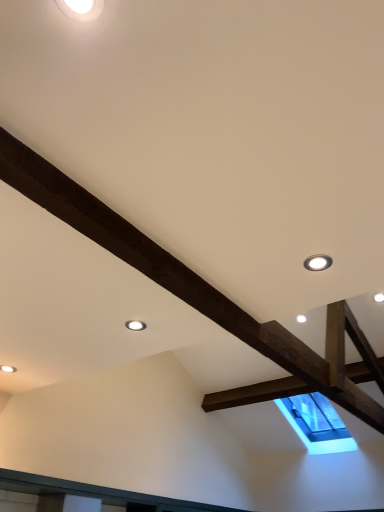
Question: Is matte white droplight at upper center, the 3th droplight when ordered from top to bottom, positioned far away from matte white droplight at upper right, positioned as the second droplight in bottom-to-top order?

Choices:
 (A) no
 (B) yes

Answer: (A)

Question: Is matte white droplight at upper center, which ranks as the first droplight in back-to-front order, outside matte white droplight at upper right, acting as the 2th droplight starting from the back?

Choices:
 (A) no
 (B) yes

Answer: (B)

Question: Does matte white droplight at upper center, which ranks as the first droplight in back-to-front order, have a smaller size compared to matte white droplight at upper right, acting as the second droplight starting from the front?

Choices:
 (A) yes
 (B) no

Answer: (A)

Question: Is matte white droplight at upper center, which ranks as the 3th droplight in right-to-left order, in contact with matte white droplight at upper right, which is counted as the first droplight, starting from the right?

Choices:
 (A) no
 (B) yes

Answer: (A)

Question: Is matte white droplight at upper center, which ranks as the 3th droplight in right-to-left order, turned away from matte white droplight at upper right, positioned as the second droplight in bottom-to-top order?

Choices:
 (A) yes
 (B) no

Answer: (B)

Question: From a real-world perspective, is matte white droplight at upper center, the 3th droplight when ordered from top to bottom, located beneath matte white droplight at upper right, arranged as the second droplight when viewed from the top?

Choices:
 (A) no
 (B) yes

Answer: (B)

Question: Does white glossy droplight at upper left, placed as the 1th droplight when sorted from top to bottom, have a greater width compared to matte white droplight at upper right, acting as the second droplight starting from the front?

Choices:
 (A) yes
 (B) no

Answer: (B)

Question: Is white glossy droplight at upper left, which appears as the second droplight when viewed from the right, bigger than matte white droplight at upper right, which is counted as the first droplight, starting from the right?

Choices:
 (A) yes
 (B) no

Answer: (B)

Question: Considering the relative positions of white glossy droplight at upper left, which ranks as the 1th droplight in front-to-back order, and matte white droplight at upper right, positioned as the second droplight in bottom-to-top order, in the image provided, is white glossy droplight at upper left, which ranks as the 1th droplight in front-to-back order, behind matte white droplight at upper right, positioned as the second droplight in bottom-to-top order,?

Choices:
 (A) yes
 (B) no

Answer: (B)

Question: From a real-world perspective, is white glossy droplight at upper left, positioned as the 2th droplight in left-to-right order, on matte white droplight at upper right, positioned as the second droplight in bottom-to-top order?

Choices:
 (A) yes
 (B) no

Answer: (A)

Question: Does white glossy droplight at upper left, which appears as the second droplight when viewed from the right, appear on the left side of matte white droplight at upper right, acting as the second droplight starting from the front?

Choices:
 (A) no
 (B) yes

Answer: (B)

Question: Does white glossy droplight at upper left, the third droplight ordered from the bottom, have a greater height compared to matte white droplight at upper right, which is counted as the first droplight, starting from the right?

Choices:
 (A) no
 (B) yes

Answer: (A)

Question: Does matte white droplight at upper right, acting as the 2th droplight starting from the back, turn towards matte white droplight at upper center, the 3th droplight when ordered from top to bottom?

Choices:
 (A) no
 (B) yes

Answer: (A)